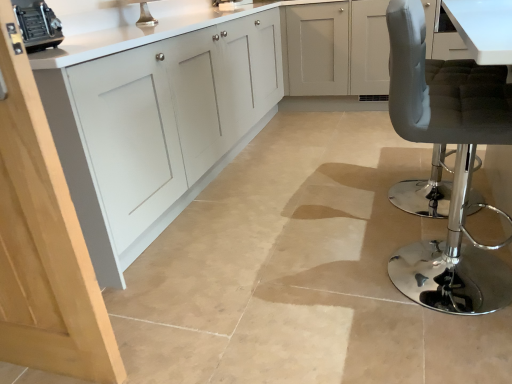
Question: Is metallic silver toaster at upper left completely or partially outside of matte gray cushioned stool at right?

Choices:
 (A) no
 (B) yes

Answer: (B)

Question: Is metallic silver toaster at upper left surrounding matte gray cushioned stool at right?

Choices:
 (A) no
 (B) yes

Answer: (A)

Question: Are metallic silver toaster at upper left and matte gray cushioned stool at right located far from each other?

Choices:
 (A) yes
 (B) no

Answer: (A)

Question: Does metallic silver toaster at upper left have a greater height compared to matte gray cushioned stool at right?

Choices:
 (A) no
 (B) yes

Answer: (A)

Question: Is metallic silver toaster at upper left thinner than matte gray cushioned stool at right?

Choices:
 (A) yes
 (B) no

Answer: (A)

Question: Is metallic silver toaster at upper left turned away from matte gray cushioned stool at right?

Choices:
 (A) yes
 (B) no

Answer: (B)

Question: Is metallic silver toaster at upper left at the back of matte gray cushioned stool at right?

Choices:
 (A) yes
 (B) no

Answer: (A)

Question: Is matte gray cushioned stool at right smaller than metallic silver toaster at upper left?

Choices:
 (A) no
 (B) yes

Answer: (A)

Question: Could metallic silver toaster at upper left be considered to be inside matte gray cushioned stool at right?

Choices:
 (A) yes
 (B) no

Answer: (B)

Question: From the image's perspective, would you say matte gray cushioned stool at right is positioned over metallic silver toaster at upper left?

Choices:
 (A) no
 (B) yes

Answer: (A)

Question: Is matte gray cushioned stool at right to the right of metallic silver toaster at upper left from the viewer's perspective?

Choices:
 (A) yes
 (B) no

Answer: (A)

Question: Is matte gray cushioned stool at right positioned behind metallic silver toaster at upper left?

Choices:
 (A) no
 (B) yes

Answer: (A)

Question: Is matte gray cushioned stool at right facing away from matte white cabinets at center?

Choices:
 (A) yes
 (B) no

Answer: (A)